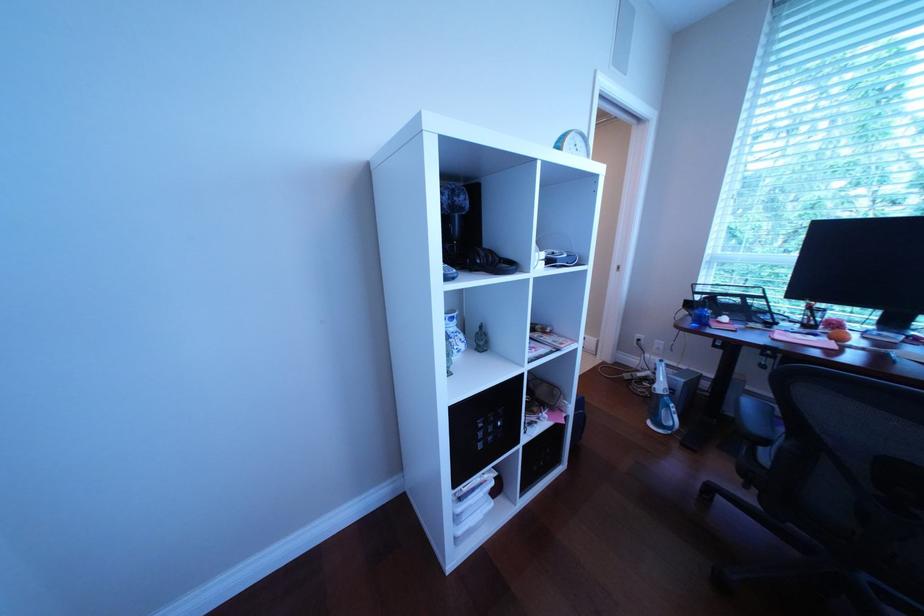
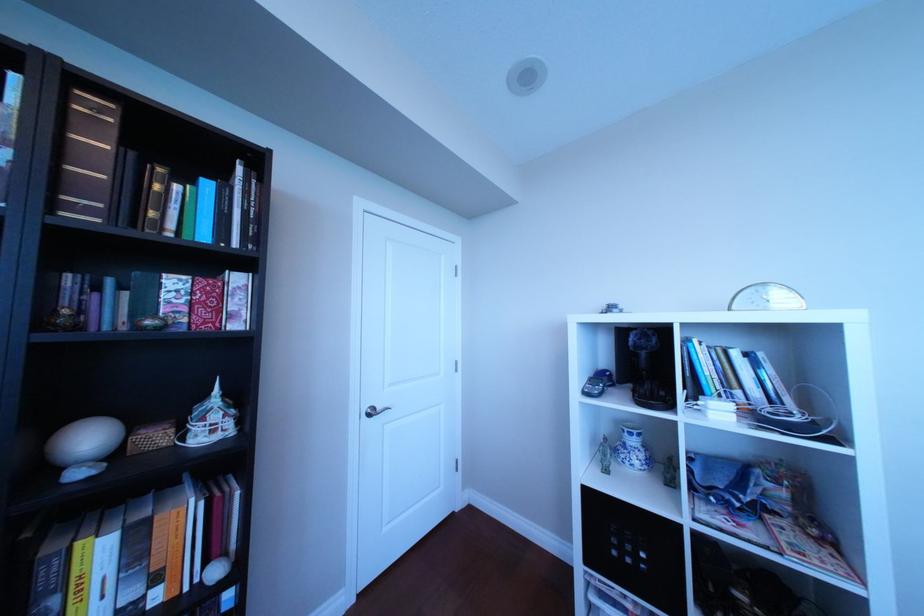
Question: Based on the continuous images, in which direction is the camera rotating? Reply with the corresponding letter.

Choices:
 (A) Left
 (B) Right
 (C) Up
 (D) Down

Answer: (A)